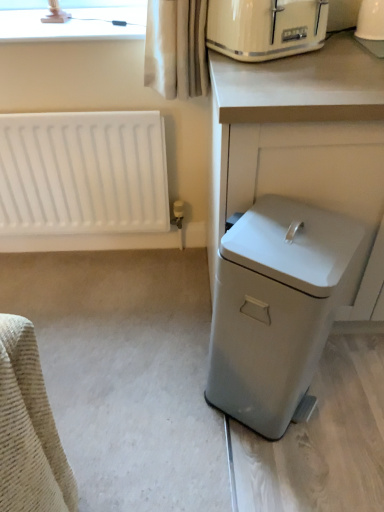
Question: From the image's perspective, is matte cream toaster at upper right located above white plastic trash can at right?

Choices:
 (A) no
 (B) yes

Answer: (B)

Question: From a real-world perspective, is matte cream toaster at upper right on white plastic trash can at right?

Choices:
 (A) yes
 (B) no

Answer: (A)

Question: Is matte cream toaster at upper right placed right next to white plastic trash can at right?

Choices:
 (A) no
 (B) yes

Answer: (A)

Question: Does matte cream toaster at upper right appear on the left side of white plastic trash can at right?

Choices:
 (A) no
 (B) yes

Answer: (B)

Question: Can you confirm if matte cream toaster at upper right is shorter than white plastic trash can at right?

Choices:
 (A) no
 (B) yes

Answer: (B)

Question: Can you confirm if matte cream toaster at upper right is positioned to the right of white plastic trash can at right?

Choices:
 (A) no
 (B) yes

Answer: (A)

Question: From a real-world perspective, is white plastic trash can at right physically above white matte radiator at left?

Choices:
 (A) no
 (B) yes

Answer: (B)

Question: From a real-world perspective, is white plastic trash can at right below white matte radiator at left?

Choices:
 (A) no
 (B) yes

Answer: (A)

Question: Is white plastic trash can at right outside of white matte radiator at left?

Choices:
 (A) yes
 (B) no

Answer: (A)

Question: Is white plastic trash can at right in front of white matte radiator at left?

Choices:
 (A) yes
 (B) no

Answer: (A)

Question: From the image's perspective, would you say white plastic trash can at right is shown under white matte radiator at left?

Choices:
 (A) no
 (B) yes

Answer: (B)

Question: Considering the relative sizes of white plastic trash can at right and white matte radiator at left in the image provided, is white plastic trash can at right taller than white matte radiator at left?

Choices:
 (A) no
 (B) yes

Answer: (B)

Question: Does white glossy coffee maker at upper right have a smaller size compared to matte cream toaster at upper right?

Choices:
 (A) yes
 (B) no

Answer: (A)